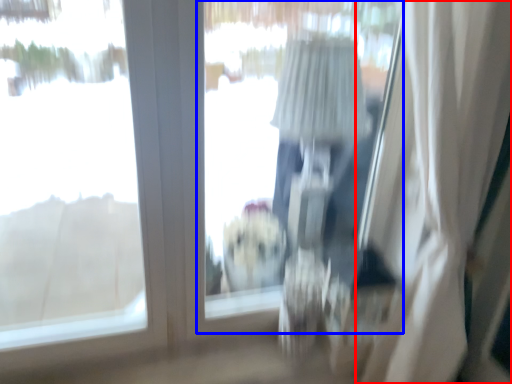
Question: Which point is closer to the camera, curtain (highlighted by a red box) or window screen (highlighted by a blue box)?

Choices:
 (A) curtain
 (B) window screen

Answer: (A)